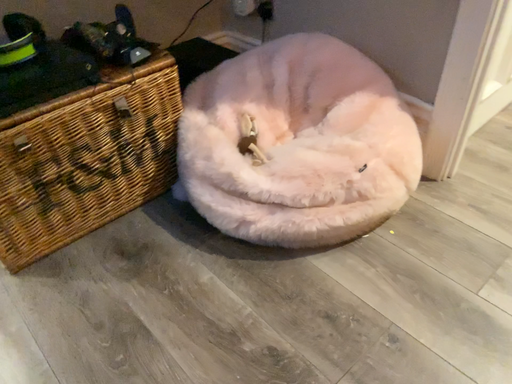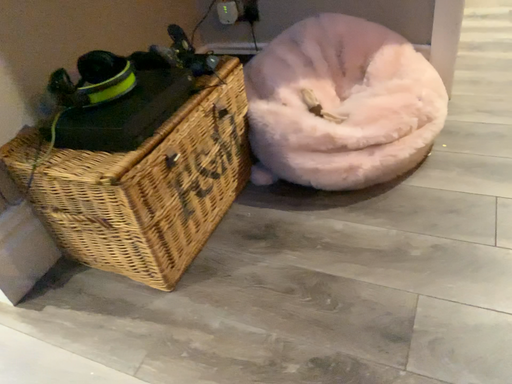
Question: Which way did the camera rotate in the video?

Choices:
 (A) rotated upward
 (B) rotated downward

Answer: (A)